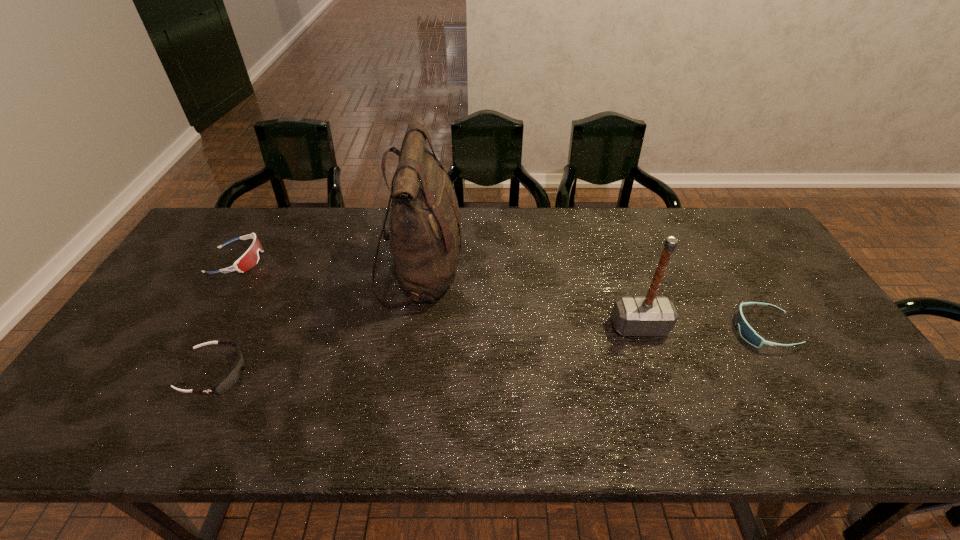
In order to click on goggles identified as the second closest to the rightmost goggles in this screenshot , I will do (250, 258).

Identify the location of goggles that is the closest one to the rightmost goggles. (231, 378).